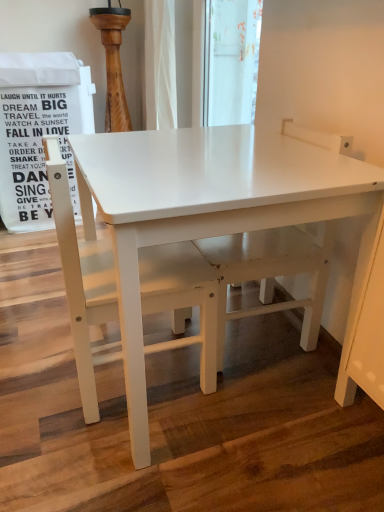
Question: In terms of width, does white matte table at center look wider or thinner when compared to white matte chair at center?

Choices:
 (A) thin
 (B) wide

Answer: (B)

Question: From a real-world perspective, is white matte table at center above or below white matte chair at center?

Choices:
 (A) above
 (B) below

Answer: (B)

Question: Is white matte table at center in front of or behind white matte chair at center in the image?

Choices:
 (A) front
 (B) behind

Answer: (A)

Question: From the image's perspective, is white matte chair at center above or below white matte table at center?

Choices:
 (A) below
 (B) above

Answer: (A)

Question: Is white matte chair at center situated inside white matte table at center or outside?

Choices:
 (A) inside
 (B) outside

Answer: (A)

Question: Considering the positions of white matte chair at center and white matte table at center in the image, is white matte chair at center taller or shorter than white matte table at center?

Choices:
 (A) short
 (B) tall

Answer: (A)

Question: From a real-world perspective, is white matte chair at center physically located above or below white matte table at center?

Choices:
 (A) below
 (B) above

Answer: (B)